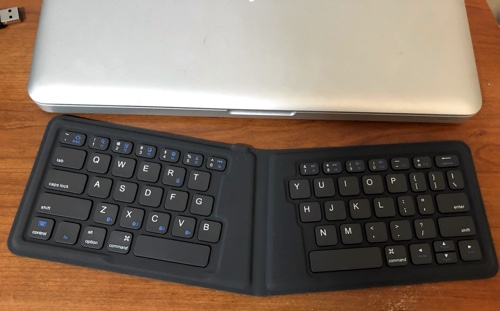
Find the location of a particular element. The width and height of the screenshot is (500, 311). usb plug is located at coordinates (10, 17).